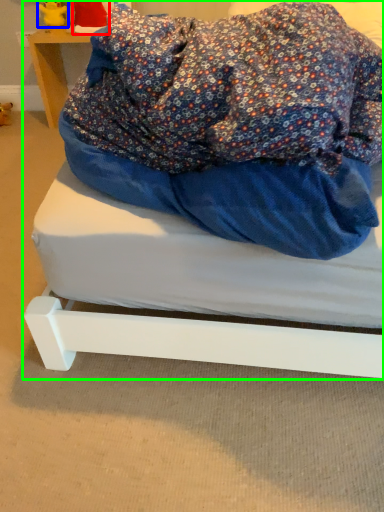
Question: Which is nearer to the toy (highlighted by a red box)? figurine (highlighted by a blue box) or bed (highlighted by a green box).

Choices:
 (A) figurine
 (B) bed

Answer: (A)